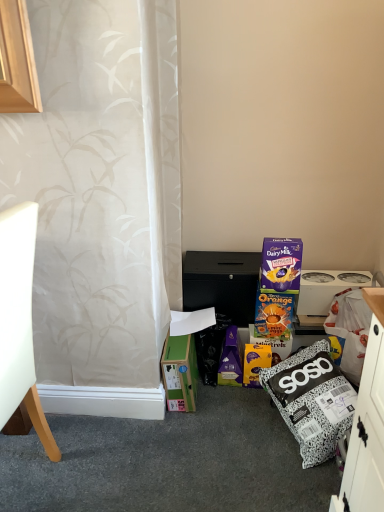
Question: Does black matte cabinet at center turn towards green cardboard box at lower left?

Choices:
 (A) yes
 (B) no

Answer: (B)

Question: Is black matte cabinet at center at the left side of green cardboard box at lower left?

Choices:
 (A) no
 (B) yes

Answer: (A)

Question: Does black matte cabinet at center appear on the right side of green cardboard box at lower left?

Choices:
 (A) yes
 (B) no

Answer: (A)

Question: From the image's perspective, would you say black matte cabinet at center is shown under green cardboard box at lower left?

Choices:
 (A) no
 (B) yes

Answer: (A)

Question: From a real-world perspective, is black matte cabinet at center located higher than green cardboard box at lower left?

Choices:
 (A) no
 (B) yes

Answer: (B)

Question: In the image, is black matte cabinet at center on the left side or the right side of white plastic appliance at right?

Choices:
 (A) right
 (B) left

Answer: (B)

Question: From their relative heights in the image, would you say black matte cabinet at center is taller or shorter than white plastic appliance at right?

Choices:
 (A) short
 (B) tall

Answer: (B)

Question: In the image, is black matte cabinet at center positioned in front of or behind white plastic appliance at right?

Choices:
 (A) front
 (B) behind

Answer: (A)

Question: From the image's perspective, is black matte cabinet at center located above or below white plastic appliance at right?

Choices:
 (A) below
 (B) above

Answer: (B)

Question: From a real-world perspective, relative to black matte cabinet at center, is green cardboard box at lower left vertically above or below?

Choices:
 (A) above
 (B) below

Answer: (B)

Question: Is point (193, 355) positioned closer to the camera than point (218, 290)?

Choices:
 (A) closer
 (B) farther

Answer: (A)

Question: In the image, is green cardboard box at lower left on the left side or the right side of black matte cabinet at center?

Choices:
 (A) left
 (B) right

Answer: (A)

Question: Is green cardboard box at lower left inside or outside of black matte cabinet at center?

Choices:
 (A) outside
 (B) inside

Answer: (A)

Question: Is white matte chair at left taller or shorter than white plastic appliance at right?

Choices:
 (A) short
 (B) tall

Answer: (B)

Question: From the image's perspective, relative to white plastic appliance at right, is white matte chair at left above or below?

Choices:
 (A) below
 (B) above

Answer: (A)